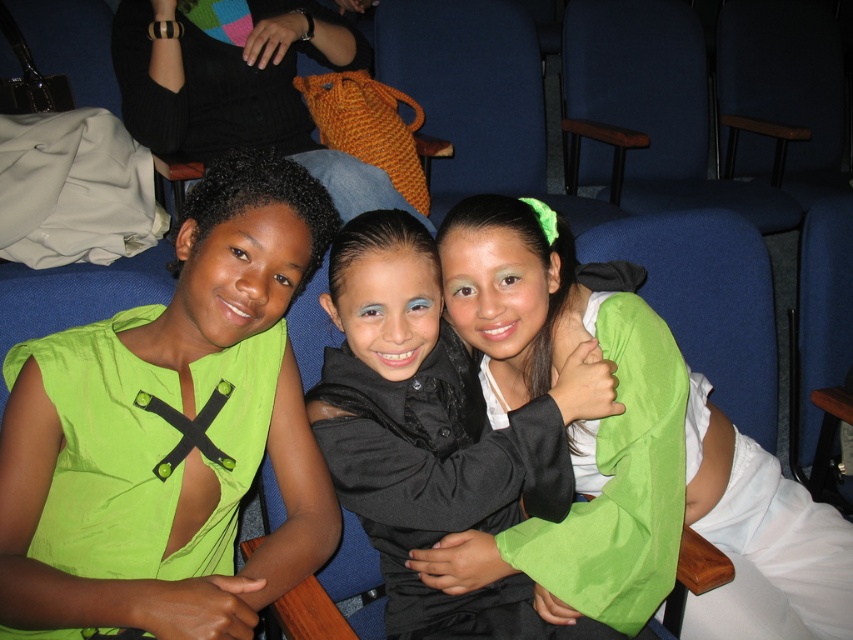
Question: Which of the following is the farthest from the observer?

Choices:
 (A) lime green fabric shirt at left
 (B) matte black jacket at center
 (C) knitted orange bag at upper center

Answer: (C)

Question: Does green satin dress at center lie in front of knitted orange bag at upper center?

Choices:
 (A) no
 (B) yes

Answer: (B)

Question: Is lime green fabric shirt at left wider than knitted orange bag at upper center?

Choices:
 (A) yes
 (B) no

Answer: (B)

Question: Is lime green fabric shirt at left in front of green satin dress at center?

Choices:
 (A) no
 (B) yes

Answer: (B)

Question: Which point is closer to the camera?

Choices:
 (A) knitted orange bag at upper center
 (B) matte black jacket at center

Answer: (B)

Question: Estimate the real-world distances between objects in this image. Which object is closer to the lime green fabric shirt at left?

Choices:
 (A) green satin dress at center
 (B) knitted orange bag at upper center

Answer: (A)